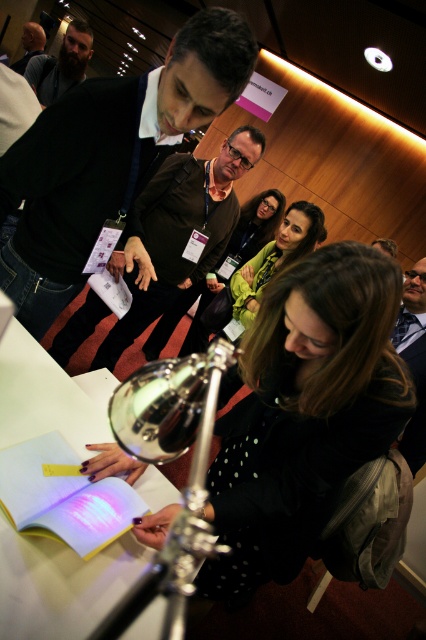
Is dark brown leather jacket at upper right thinner than bearded man at upper left?

Yes.

How much distance is there between dark brown leather jacket at upper right and bearded man at upper left?

7.74 feet

Locate an element on the screen. Image resolution: width=426 pixels, height=640 pixels. dark brown leather jacket at upper right is located at coordinates (x=414, y=358).

Looking at this image, which is above, matte black jacket at center or bearded man at upper left?

bearded man at upper left

Is point (265, 273) positioned in front of point (75, 67)?

Yes, point (265, 273) is in front of point (75, 67).

Locate an element on the screen. The height and width of the screenshot is (640, 426). matte black jacket at center is located at coordinates (275, 257).

Measure the distance between dark blue sweater at upper left and dark brown leather jacket at center.

dark blue sweater at upper left and dark brown leather jacket at center are 21.61 inches apart.

Who is more forward, (37, 317) or (164, 195)?

Point (37, 317) is more forward.

The width and height of the screenshot is (426, 640). I want to click on dark blue sweater at upper left, so click(109, 161).